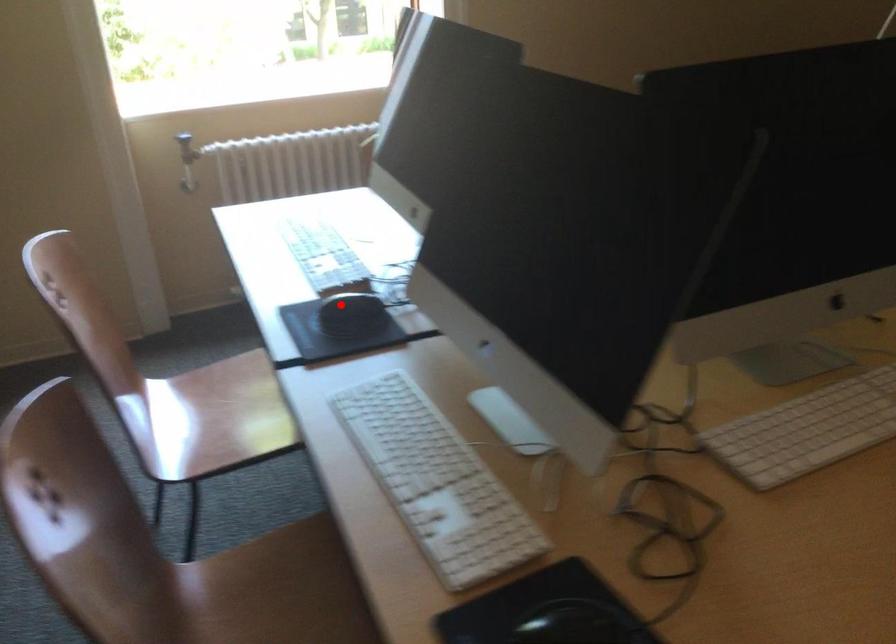
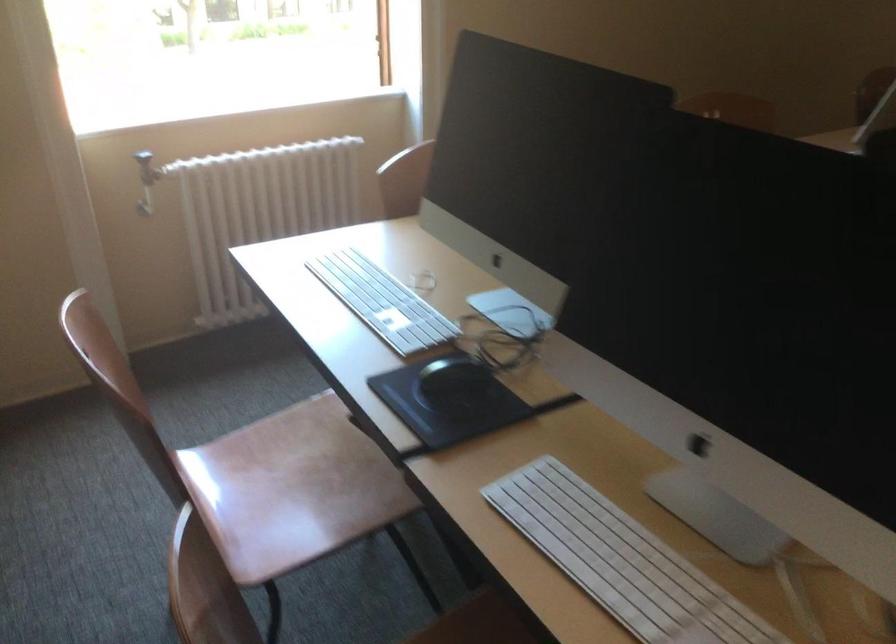
In the second image, find the point that corresponds to the highlighted location in the first image.

(452, 377)